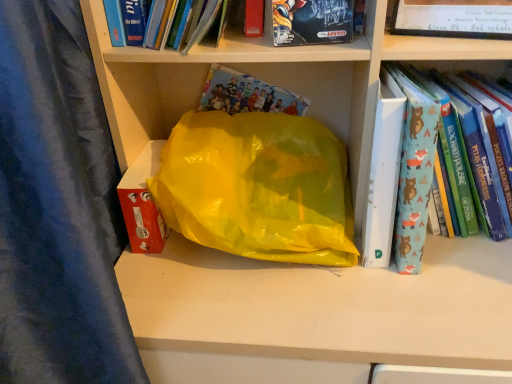
Question: Could you tell me if blue fabric book at right, marked as the 1th book in a right-to-left arrangement, is turned towards hardcover book at upper center, the first book when ordered from left to right?

Choices:
 (A) yes
 (B) no

Answer: (B)

Question: Does blue fabric book at right, marked as the 1th book in a right-to-left arrangement, have a lesser height compared to hardcover book at upper center, the third book from the right?

Choices:
 (A) yes
 (B) no

Answer: (B)

Question: Considering the relative sizes of blue fabric book at right, which appears as the third book when viewed from the left, and hardcover book at upper center, the third book from the right, in the image provided, is blue fabric book at right, which appears as the third book when viewed from the left, wider than hardcover book at upper center, the third book from the right,?

Choices:
 (A) no
 (B) yes

Answer: (B)

Question: From a real-world perspective, is blue fabric book at right, marked as the 1th book in a right-to-left arrangement, under hardcover book at upper center, the first book when ordered from left to right?

Choices:
 (A) yes
 (B) no

Answer: (A)

Question: From the image's perspective, is blue fabric book at right, which appears as the third book when viewed from the left, above hardcover book at upper center, the third book from the right?

Choices:
 (A) no
 (B) yes

Answer: (A)

Question: Looking at their shapes, would you say matt black board game at upper center, the 2th book from the left, is wider or thinner than blue fabric book at right, marked as the 1th book in a right-to-left arrangement?

Choices:
 (A) thin
 (B) wide

Answer: (A)

Question: Considering the positions of matt black board game at upper center, the 2th book from the left, and blue fabric book at right, marked as the 1th book in a right-to-left arrangement, in the image, is matt black board game at upper center, the 2th book from the left, taller or shorter than blue fabric book at right, marked as the 1th book in a right-to-left arrangement,?

Choices:
 (A) tall
 (B) short

Answer: (B)

Question: Considering their positions, is matt black board game at upper center, which is the second book from right to left, located in front of or behind blue fabric book at right, marked as the 1th book in a right-to-left arrangement?

Choices:
 (A) behind
 (B) front

Answer: (B)

Question: Does point (279, 4) appear closer or farther from the camera than point (474, 132)?

Choices:
 (A) farther
 (B) closer

Answer: (B)

Question: Is point (115, 34) positioned closer to the camera than point (309, 38)?

Choices:
 (A) closer
 (B) farther

Answer: (B)

Question: Is hardcover book at upper center, the third book from the right, bigger or smaller than matt black board game at upper center, the 2th book from the left?

Choices:
 (A) small
 (B) big

Answer: (B)

Question: From a real-world perspective, relative to matt black board game at upper center, the 2th book from the left, is hardcover book at upper center, the first book when ordered from left to right, vertically above or below?

Choices:
 (A) below
 (B) above

Answer: (B)

Question: From the image's perspective, is hardcover book at upper center, the third book from the right, above or below matt black board game at upper center, which is the second book from right to left?

Choices:
 (A) below
 (B) above

Answer: (B)

Question: From the image's perspective, relative to hardcover book at upper center, the first book when ordered from left to right, is blue fabric book at right, marked as the 1th book in a right-to-left arrangement, above or below?

Choices:
 (A) below
 (B) above

Answer: (A)

Question: In the image, is blue fabric book at right, marked as the 1th book in a right-to-left arrangement, positioned in front of or behind hardcover book at upper center, the first book when ordered from left to right?

Choices:
 (A) front
 (B) behind

Answer: (B)